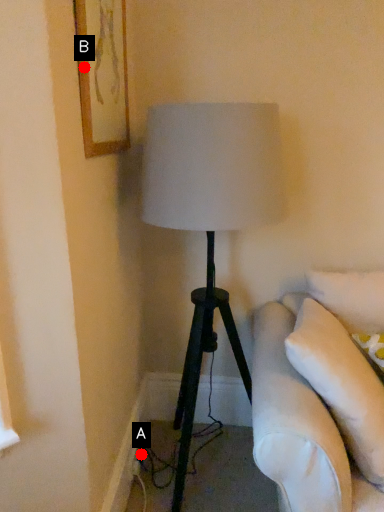
Question: Two points are circled on the image, labeled by A and B beside each circle. Which of the following is the closest to the observer?

Choices:
 (A) A is closer
 (B) B is closer

Answer: (B)